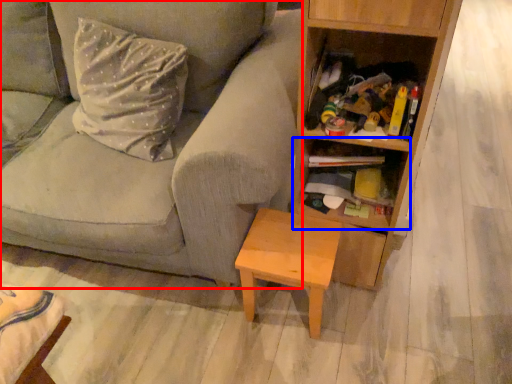
Question: Which of the following is the farthest to the observer, studio couch (highlighted by a red box) or shelf (highlighted by a blue box)?

Choices:
 (A) studio couch
 (B) shelf

Answer: (B)